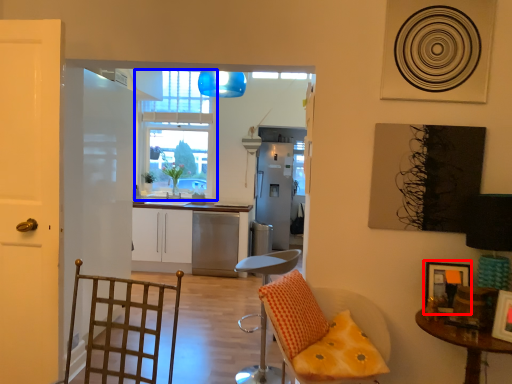
Question: Which object is closer to the camera taking this photo, picture frame (highlighted by a red box) or window (highlighted by a blue box)?

Choices:
 (A) picture frame
 (B) window

Answer: (A)